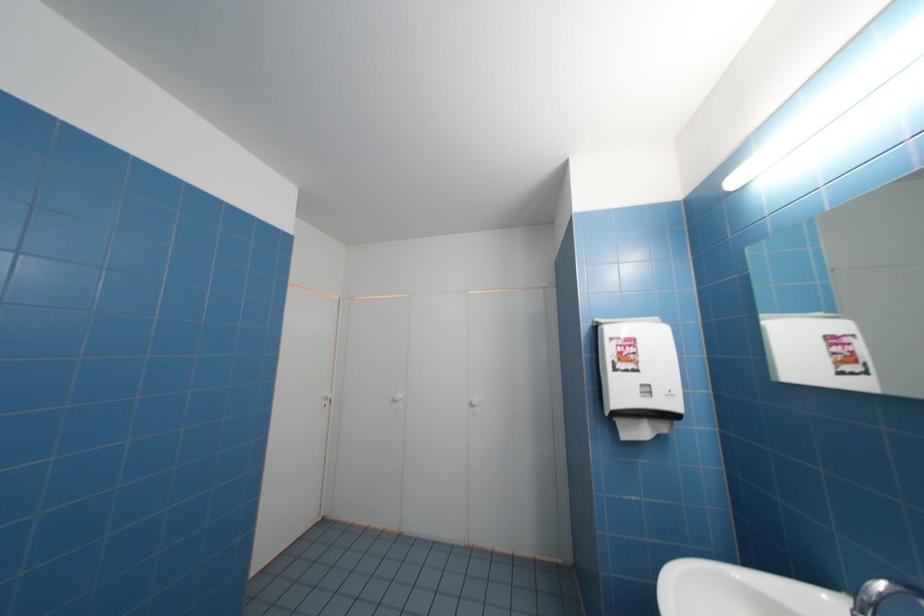
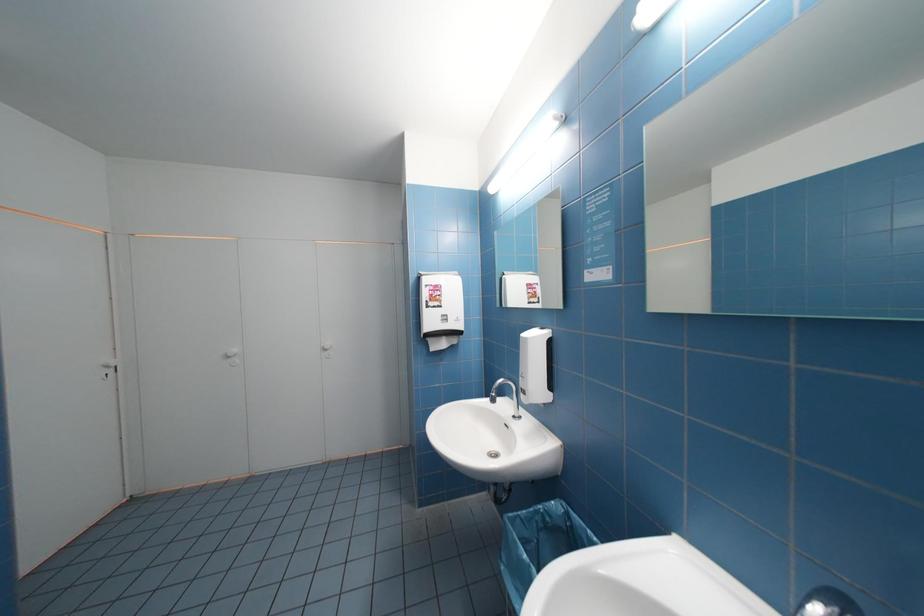
Question: The first image is from the beginning of the video and the second image is from the end. How did the camera likely rotate when shooting the video?

Choices:
 (A) Left
 (B) Right
 (C) Up
 (D) Down

Answer: (B)